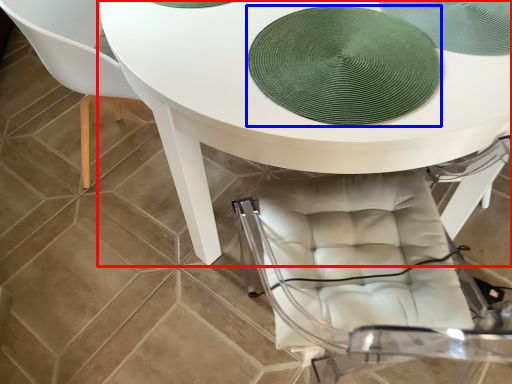
Question: Which object appears closest to the camera in this image, table (highlighted by a red box) or mat (highlighted by a blue box)?

Choices:
 (A) table
 (B) mat

Answer: (A)